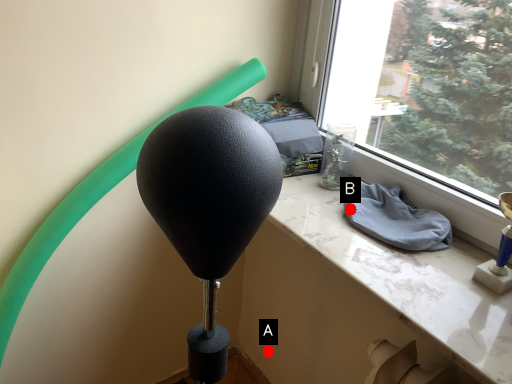
Question: Two points are circled on the image, labeled by A and B beside each circle. Which point appears farthest from the camera in this image?

Choices:
 (A) A is further
 (B) B is further

Answer: (A)